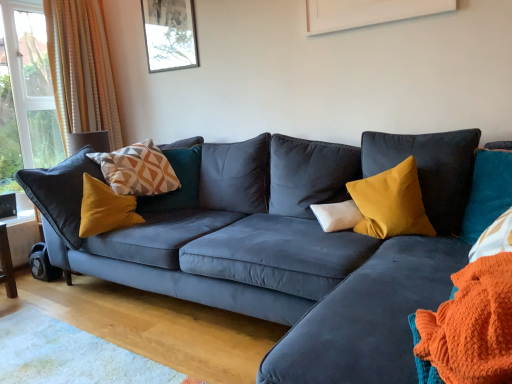
Question: In which direction should I rotate to look at white soft cushion at center, which is the second pillow in left-to-right order?

Choices:
 (A) right
 (B) left

Answer: (A)

Question: Which direction should I rotate to look at velvet mustard pillow at center, positioned as the 1th pillow in right-to-left order, — up or down?

Choices:
 (A) down
 (B) up

Answer: (A)

Question: Is orange knitted blanket at lower right positioned behind matte glass picture frame at upper center?

Choices:
 (A) no
 (B) yes

Answer: (A)

Question: Does orange knitted blanket at lower right appear on the left side of matte glass picture frame at upper center?

Choices:
 (A) yes
 (B) no

Answer: (B)

Question: From a real-world perspective, is orange knitted blanket at lower right on top of matte glass picture frame at upper center?

Choices:
 (A) no
 (B) yes

Answer: (A)

Question: From the image's perspective, would you say orange knitted blanket at lower right is shown under matte glass picture frame at upper center?

Choices:
 (A) no
 (B) yes

Answer: (B)

Question: Can you confirm if orange knitted blanket at lower right is positioned to the right of matte glass picture frame at upper center?

Choices:
 (A) no
 (B) yes

Answer: (B)

Question: From the image's perspective, is orange knitted blanket at lower right on top of matte glass picture frame at upper center?

Choices:
 (A) yes
 (B) no

Answer: (B)

Question: From a real-world perspective, does white soft cushion at center, which is the second pillow in left-to-right order, stand above velvet mustard pillow at center, positioned as the third pillow in left-to-right order?

Choices:
 (A) yes
 (B) no

Answer: (B)

Question: Are white soft cushion at center, which is the second pillow in left-to-right order, and velvet mustard pillow at center, positioned as the 1th pillow in right-to-left order, making contact?

Choices:
 (A) no
 (B) yes

Answer: (A)

Question: Considering the relative positions of white soft cushion at center, which is the second pillow in left-to-right order, and velvet mustard pillow at center, positioned as the third pillow in left-to-right order, in the image provided, is white soft cushion at center, which is the second pillow in left-to-right order, to the right of velvet mustard pillow at center, positioned as the third pillow in left-to-right order, from the viewer's perspective?

Choices:
 (A) yes
 (B) no

Answer: (B)

Question: From a real-world perspective, does white soft cushion at center, which is the second pillow in left-to-right order, sit lower than velvet mustard pillow at center, positioned as the 1th pillow in right-to-left order?

Choices:
 (A) yes
 (B) no

Answer: (A)

Question: Does white soft cushion at center, which is the second pillow in left-to-right order, lie in front of velvet mustard pillow at center, positioned as the third pillow in left-to-right order?

Choices:
 (A) yes
 (B) no

Answer: (B)

Question: From the image's perspective, is white soft cushion at center, which is the second pillow in left-to-right order, located beneath velvet mustard pillow at center, positioned as the 1th pillow in right-to-left order?

Choices:
 (A) no
 (B) yes

Answer: (B)

Question: Is orange striped curtain at left further to camera compared to orange knitted blanket at lower right?

Choices:
 (A) yes
 (B) no

Answer: (A)